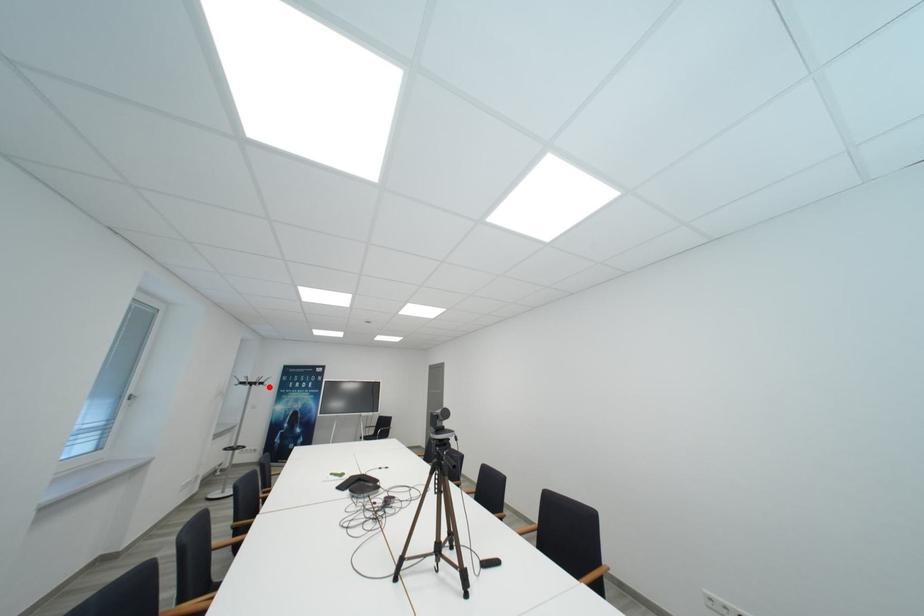
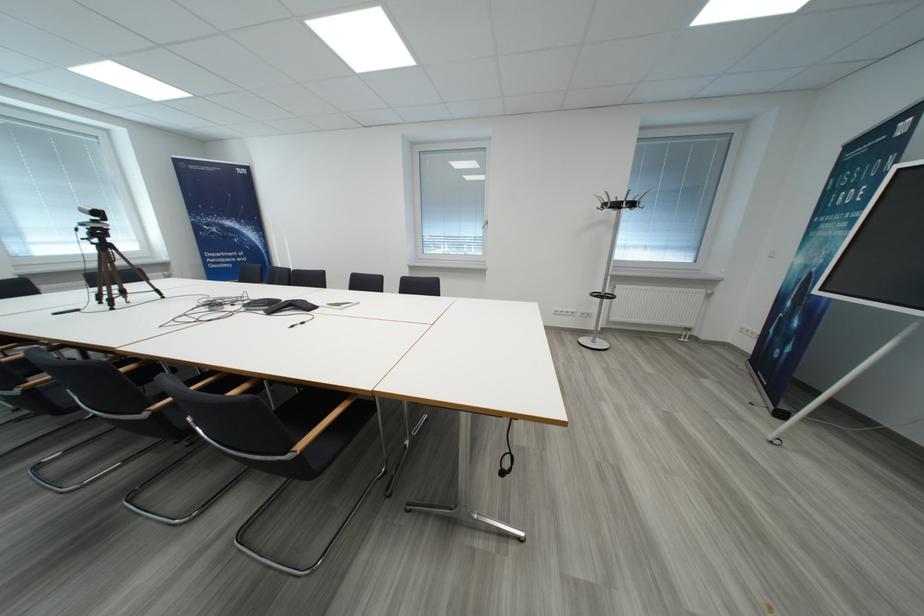
In the second image, find the point that corresponds to the highlighted location in the first image.

(623, 208)